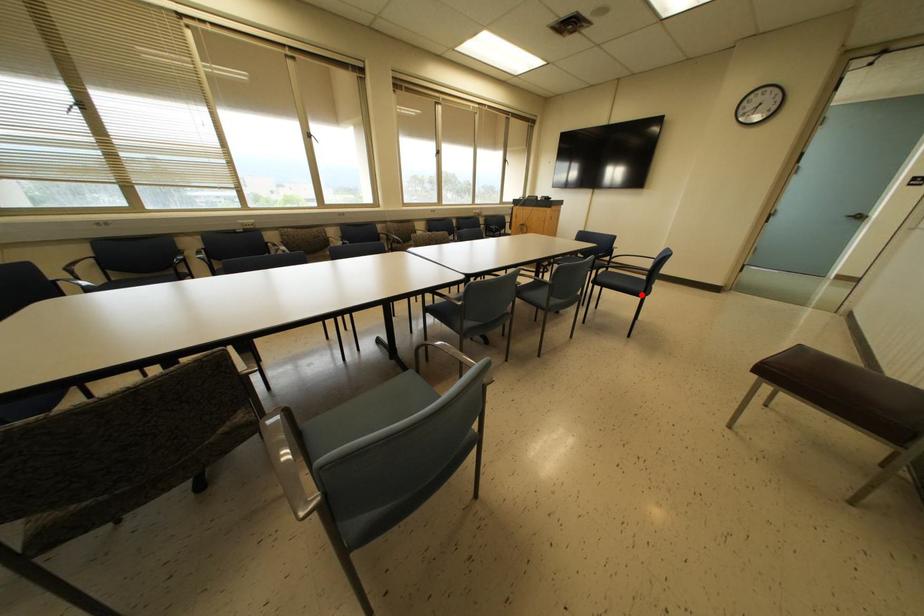
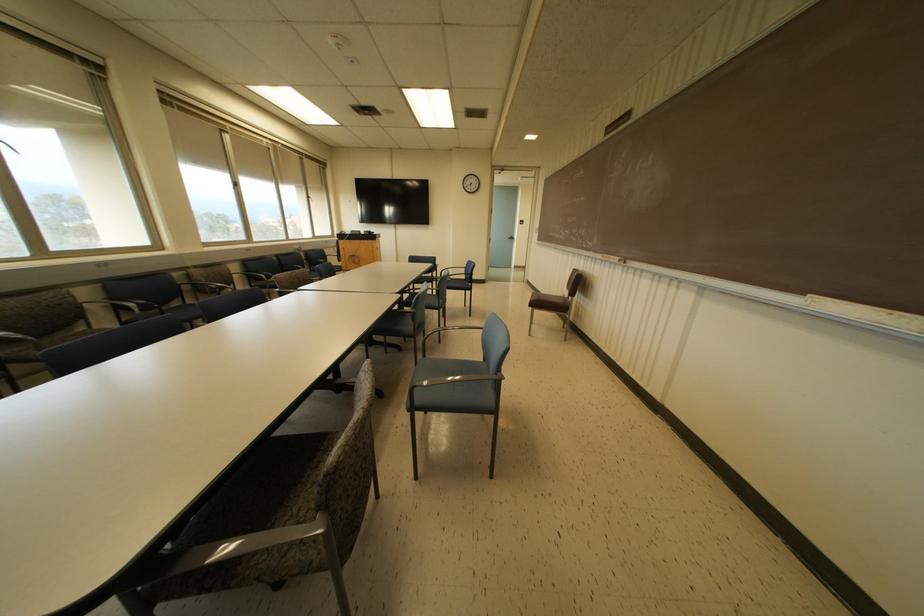
In the second image, find the point that corresponds to the highlighted location in the first image.

(468, 288)